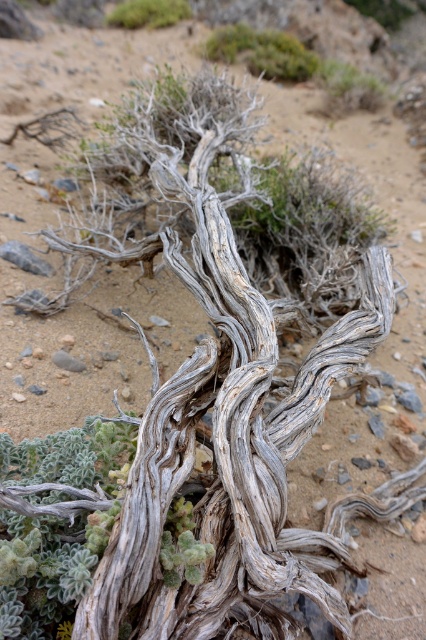
You are a geologist studying the terrain and want to locate the gray textured root at center. According to the coordinates provided, where would you find it?

The gray textured root at center is located at coordinates point (57,522).

You are standing in front of the gnarled tree trunk and see both the green leafy plant at upper center and the green fuzzy plant at upper center. Which one is closer to you?

The green leafy plant at upper center is closer to you because it is in front of the green fuzzy plant at upper center.